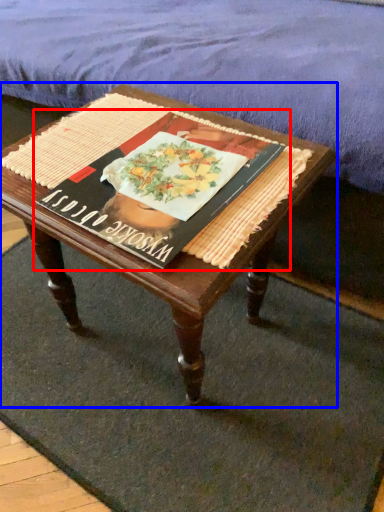
Question: Which object appears farthest to the camera in this image, paperback book (highlighted by a red box) or coffee table (highlighted by a blue box)?

Choices:
 (A) paperback book
 (B) coffee table

Answer: (A)